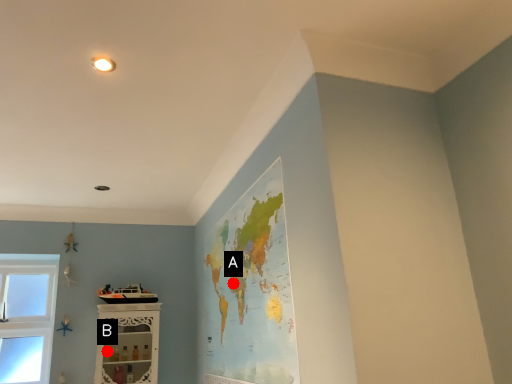
Question: Two points are circled on the image, labeled by A and B beside each circle. Which point appears closest to the camera in this image?

Choices:
 (A) A is closer
 (B) B is closer

Answer: (A)